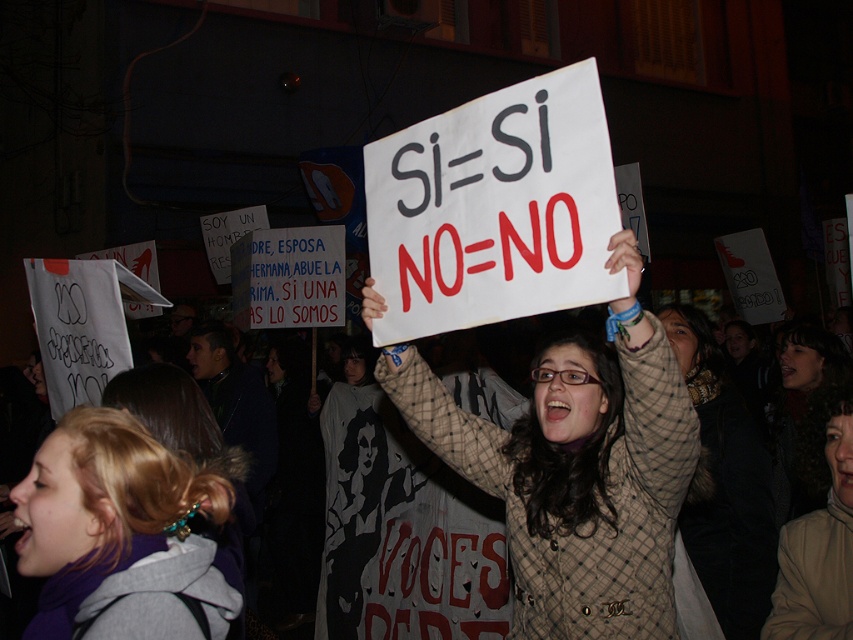
Looking at this image, you are a photographer trying to capture a clear shot of the protesters. You notice the plaid fabric coat at center and the blonde hair at center. Which object should you focus on to ensure it appears larger in your photo?

The plaid fabric coat at center is much taller than the blonde hair at center, so focusing on the plaid fabric coat at center will make it appear larger in the photo.

You are a photographer trying to capture the protest scene. You notice two points marked in the image at coordinates point (660,369) and point (80,448). If you want to focus on the point that is closer to the front of the scene, which coordinate should you choose?

Point (80,448) is closer to the front of the scene, so you should focus on point (80,448).